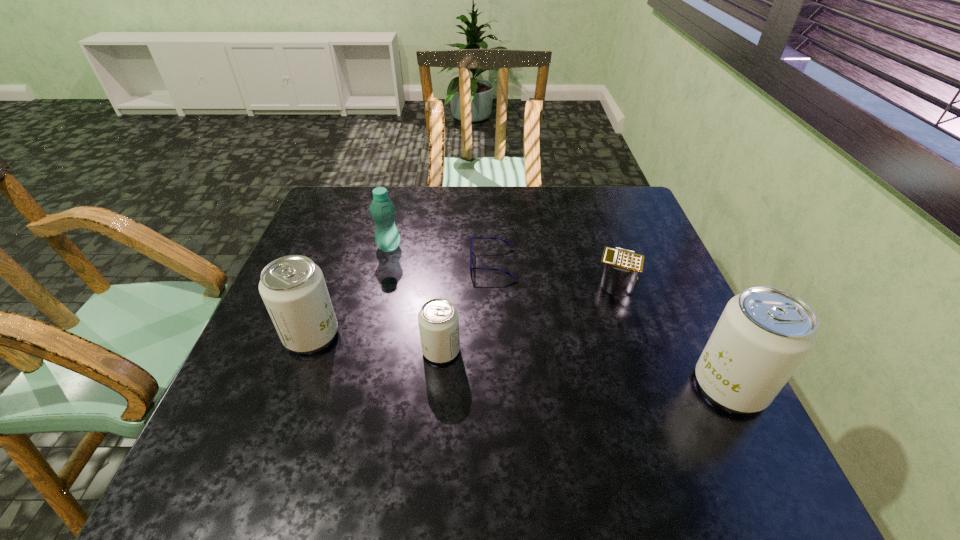
Where is `free space that is in between the spectacles and the rightmost soda can`? The image size is (960, 540). free space that is in between the spectacles and the rightmost soda can is located at coordinates (612, 325).

Image resolution: width=960 pixels, height=540 pixels. What are the coordinates of `free point between the calculator and the leftmost object` in the screenshot? It's located at (464, 308).

At what (x,y) coordinates should I click in order to perform the action: click on free space between the second shortest object and the rightmost object. Please return your answer as a coordinate pair (x, y). This screenshot has height=540, width=960. Looking at the image, I should click on (673, 334).

Image resolution: width=960 pixels, height=540 pixels. In order to click on free space that is in between the second object from left to right and the leftmost soda can in this screenshot , I will do `click(350, 291)`.

Locate an element on the screen. This screenshot has width=960, height=540. free space between the fourth object from left to right and the rightmost soda can is located at coordinates (612, 325).

Where is `free space between the spectacles and the third shortest object`? This screenshot has height=540, width=960. free space between the spectacles and the third shortest object is located at coordinates (468, 307).

Find the location of a particular element. The width and height of the screenshot is (960, 540). vacant area that lies between the spectacles and the fifth object from right to left is located at coordinates (441, 255).

Find the location of a particular element. The height and width of the screenshot is (540, 960). object that is the closest to the calculator is located at coordinates (764, 333).

Where is `the third closest object to the fifth tallest object`? This screenshot has width=960, height=540. the third closest object to the fifth tallest object is located at coordinates (438, 319).

Locate an element on the screen. Image resolution: width=960 pixels, height=540 pixels. the closest soda can relative to the second object from left to right is located at coordinates coord(293,289).